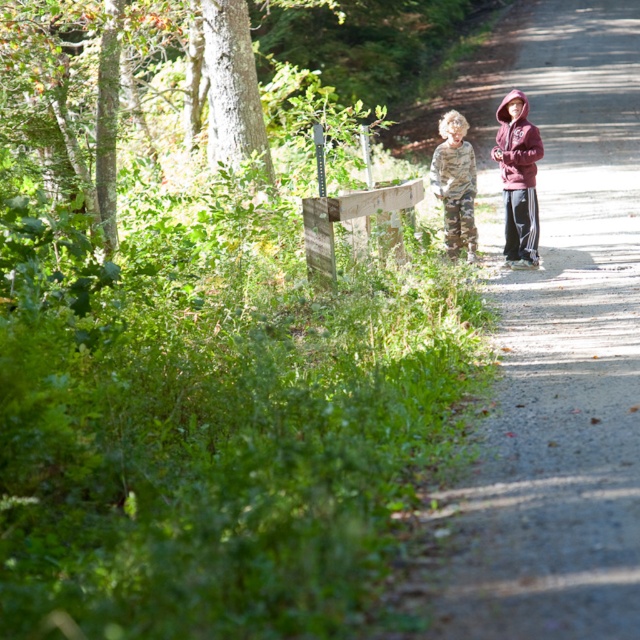
You are standing on the paved path in the scene and want to reach the wooden post with a metal sign on the left side. The post is marked with a point at coordinates point [612,548]. If your maximum reach is 10 feet, can you touch the post without moving closer?

The point [612,548] is 15.43 feet away from the viewer. Since your maximum reach is only 10 feet, you cannot touch the post without moving closer.

You are a hiker who wants to place your maroon fleece jacket at right on the gravel path at center. Is there enough vertical space between the path and the surrounding vegetation for the jacket to fit without touching the plants?

The gravel path at center is much taller than the maroon fleece jacket at right, so there is sufficient vertical space for the jacket to be placed without touching the surrounding vegetation.